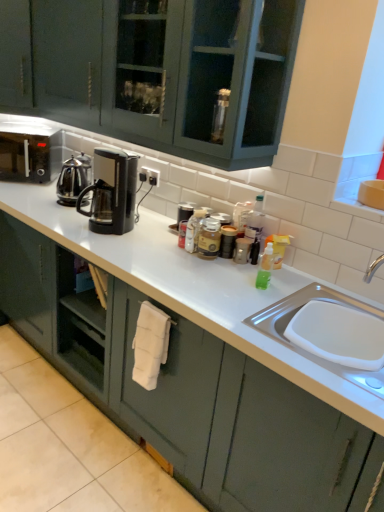
This screenshot has height=512, width=384. In order to click on free space in front of black plastic coffee maker at center, the first kitchen appliance viewed from the right in this screenshot , I will do click(x=113, y=241).